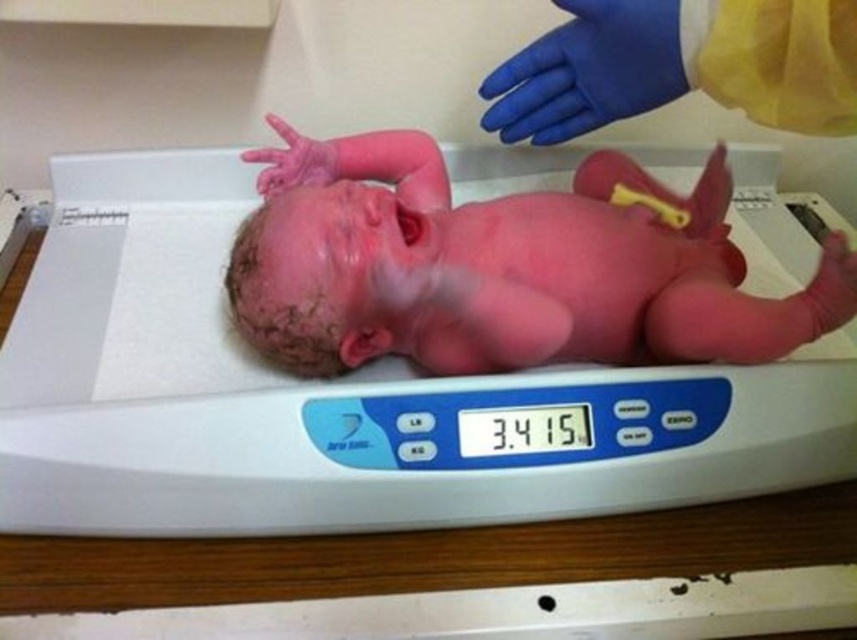
You are a nurse in a hospital nursery. You need to weigh a newborn baby using the white plastic scale at center. However, you notice the blue rubber glove at upper center nearby. Which object is closer to the baby?

The white plastic scale at center is closer to the baby because it is located below the blue rubber glove at upper center, placing it nearer to the baby lying on the scale.

You are a nurse checking the baby on the scale. The scale has a display at point (340, 397). Where is the white plastic scale located?

The white plastic scale is located at the center, as marked by point (340, 397).